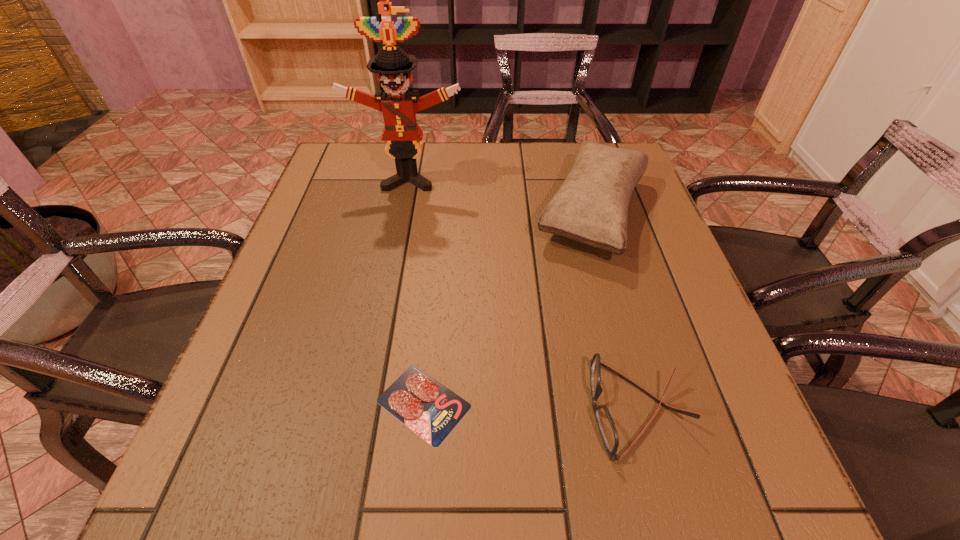
At what (x,y) coordinates should I click in order to perform the action: click on nutcracker that is at the far edge. Please return your answer as a coordinate pair (x, y). The height and width of the screenshot is (540, 960). Looking at the image, I should click on (403, 135).

The image size is (960, 540). In order to click on cushion that is at the far edge in this screenshot , I will do `click(591, 207)`.

Find the location of a particular element. object located in the near edge section of the desktop is located at coordinates (608, 432).

Find the location of a particular element. The width and height of the screenshot is (960, 540). object at the left edge is located at coordinates (403, 135).

Find the location of a particular element. cushion present at the right edge is located at coordinates (591, 207).

Find the location of `spectacles positioned at the right edge`. spectacles positioned at the right edge is located at coordinates (608, 432).

Find the location of a particular element. object at the far left corner is located at coordinates (403, 135).

You are a GUI agent. You are given a task and a screenshot of the screen. Output one action in this format:
    pyautogui.click(x=<x>, y=<y>)
    Task: Click on the object that is at the far right corner
    This screenshot has height=540, width=960.
    Given the screenshot: What is the action you would take?
    pyautogui.click(x=591, y=207)

You are a GUI agent. You are given a task and a screenshot of the screen. Output one action in this format:
    pyautogui.click(x=<x>, y=<y>)
    Task: Click on the object positioned at the near right corner
    This screenshot has height=540, width=960.
    Given the screenshot: What is the action you would take?
    pyautogui.click(x=608, y=432)

Where is `vacant space at the far edge of the desktop`? Image resolution: width=960 pixels, height=540 pixels. vacant space at the far edge of the desktop is located at coordinates (509, 159).